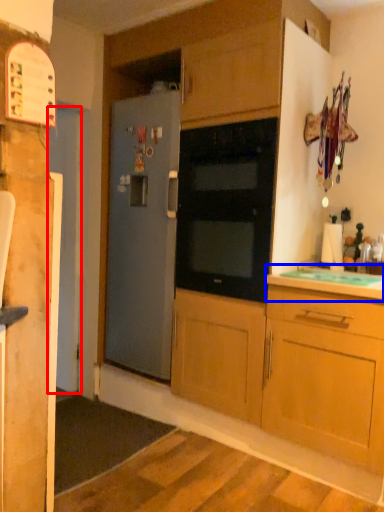
Question: Among these objects, which one is nearest to the camera, door (highlighted by a red box) or countertop (highlighted by a blue box)?

Choices:
 (A) door
 (B) countertop

Answer: (B)